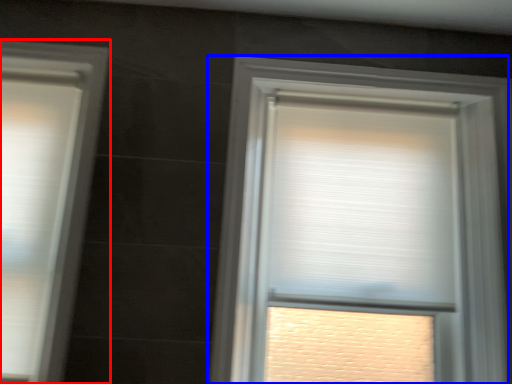
Question: Which object is closer to the camera taking this photo, window (highlighted by a red box) or window (highlighted by a blue box)?

Choices:
 (A) window
 (B) window

Answer: (A)